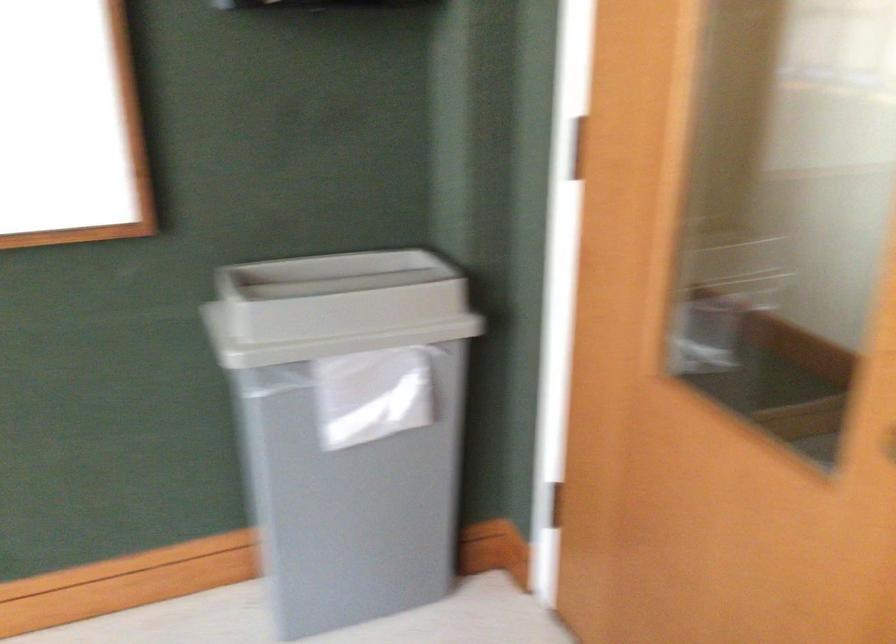
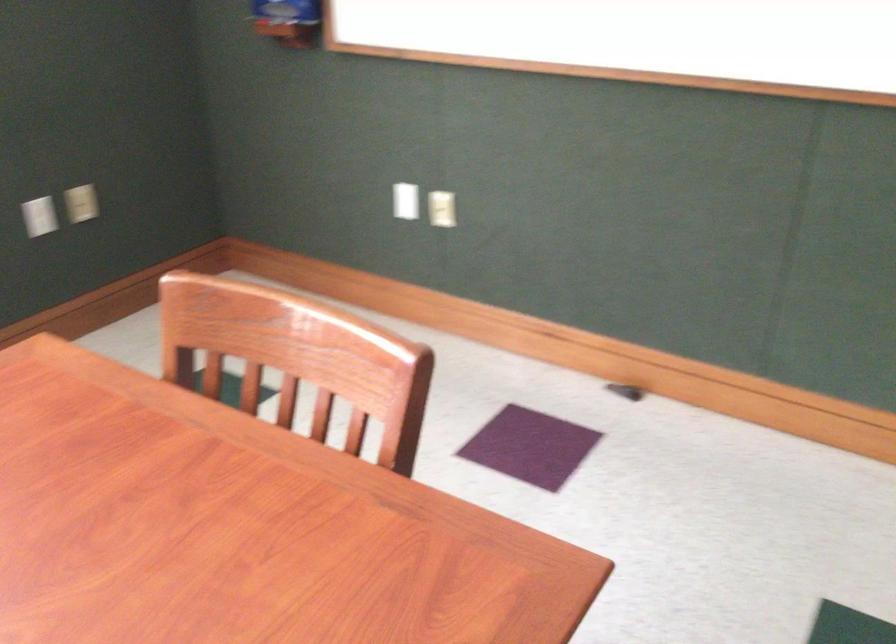
The first image is from the beginning of the video and the second image is from the end. How did the camera likely rotate when shooting the video?

The rotation direction of the camera is left-down.